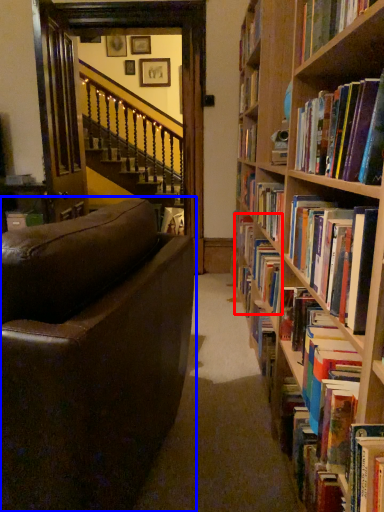
Question: Which point is closer to the camera, book (highlighted by a red box) or studio couch (highlighted by a blue box)?

Choices:
 (A) book
 (B) studio couch

Answer: (B)